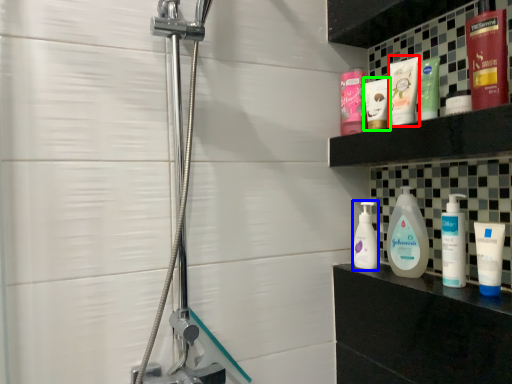
Question: Considering the real-world distances, which object is farthest from toothpaste (highlighted by a red box)? cleaning product (highlighted by a blue box) or toiletry (highlighted by a green box)?

Choices:
 (A) cleaning product
 (B) toiletry

Answer: (A)